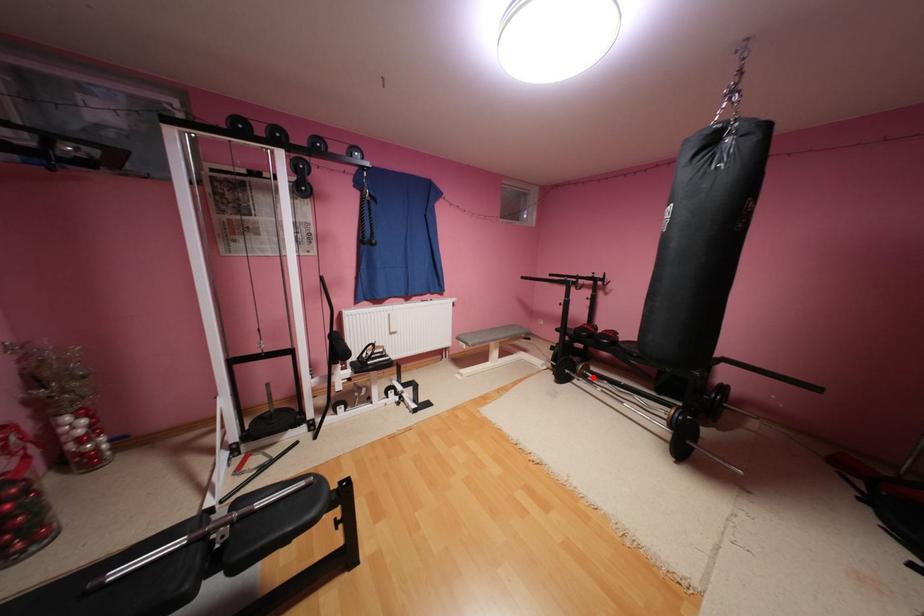
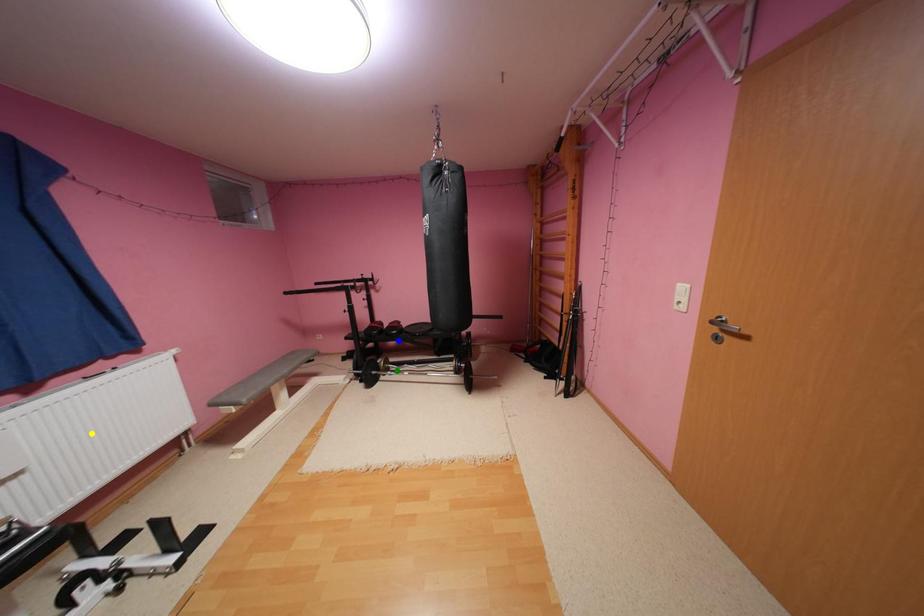
Question: I am providing you with two images of the same scene from different viewpoints. A red point is marked on the first image. You are given multiple points on the second image. Which point in image 2 is actually the same real-world point as the red point in image 1?

Choices:
 (A) green point
 (B) blue point
 (C) yellow point

Answer: (A)